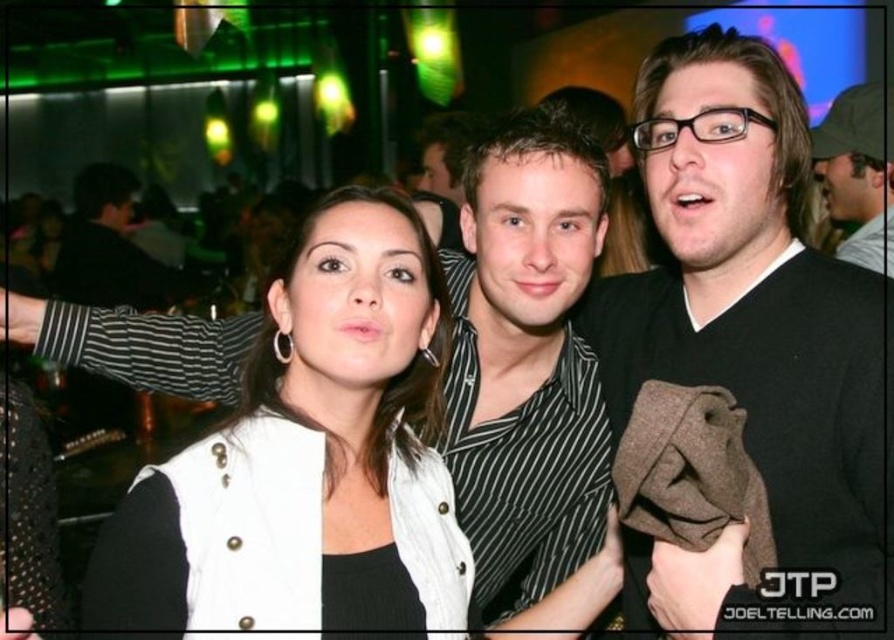
Is white textured vest at center smaller than matte black jacket at upper right?

Yes, white textured vest at center is smaller than matte black jacket at upper right.

At what (x,y) coordinates should I click in order to perform the action: click on white textured vest at center. Please return your answer as a coordinate pair (x, y). The image size is (894, 640). Looking at the image, I should click on (310, 458).

Can you confirm if black striped shirt at center is positioned to the left of black striped shirt at left?

Incorrect, black striped shirt at center is not on the left side of black striped shirt at left.

Which is in front, point (587, 160) or point (74, 196)?

Point (587, 160)

The image size is (894, 640). What do you see at coordinates (524, 356) in the screenshot?
I see `black striped shirt at center` at bounding box center [524, 356].

Identify the location of black striped shirt at center. The height and width of the screenshot is (640, 894). (524, 356).

Measure the distance between black striped shirt at left and camera.

black striped shirt at left is 20.93 feet from camera.

Between black striped shirt at left and matte black jacket at upper right, which one is positioned higher?

black striped shirt at left

You are a GUI agent. You are given a task and a screenshot of the screen. Output one action in this format:
    pyautogui.click(x=<x>, y=<y>)
    Task: Click on the black striped shirt at left
    The image size is (894, 640).
    Given the screenshot: What is the action you would take?
    pyautogui.click(x=110, y=248)